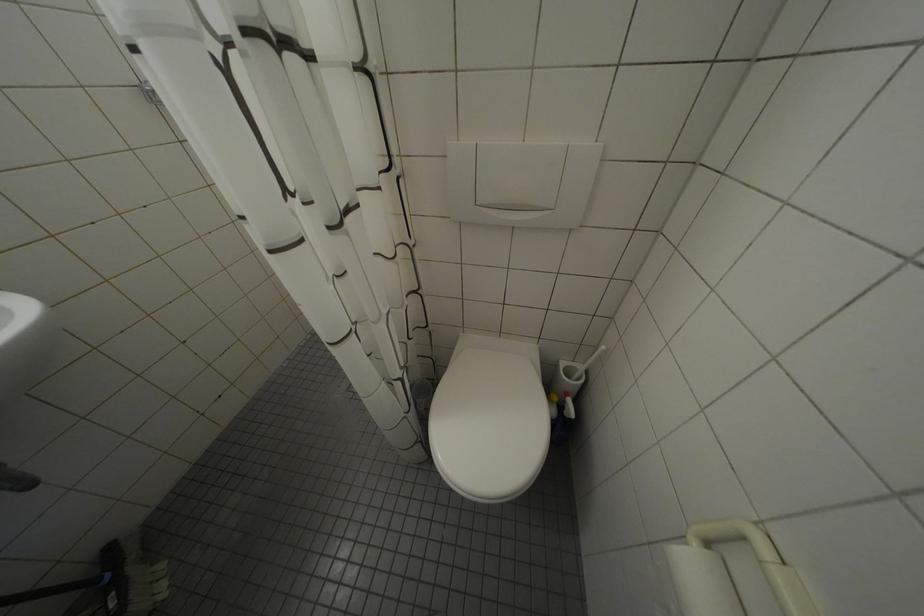
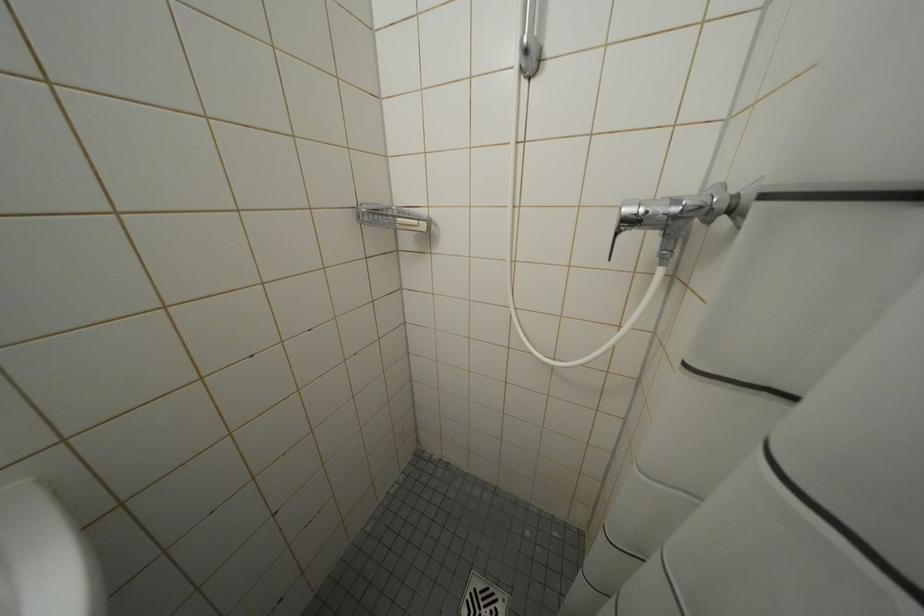
Question: The images are taken continuously from a first-person perspective. In which direction is your viewpoint rotating?

Choices:
 (A) Left
 (B) Right
 (C) Up
 (D) Down

Answer: (C)